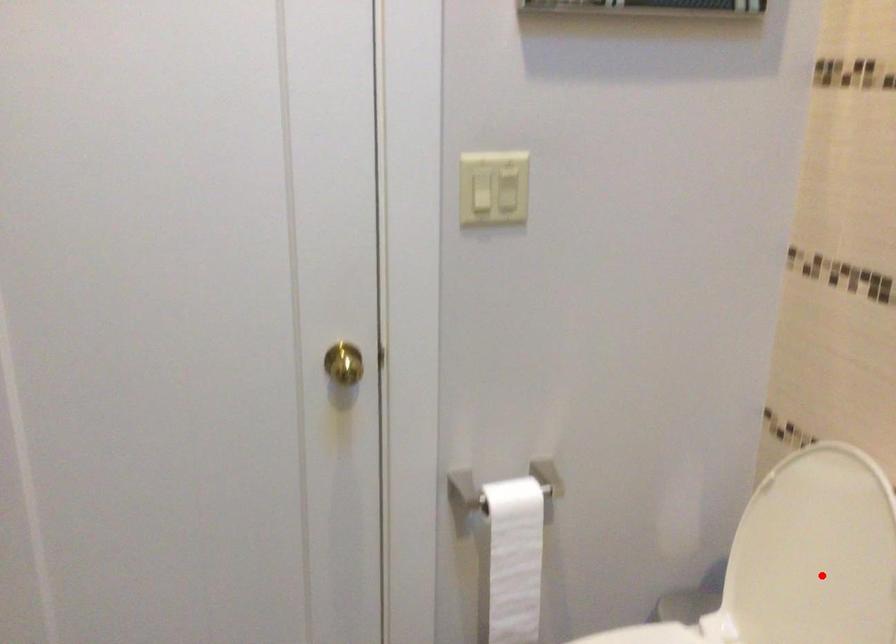
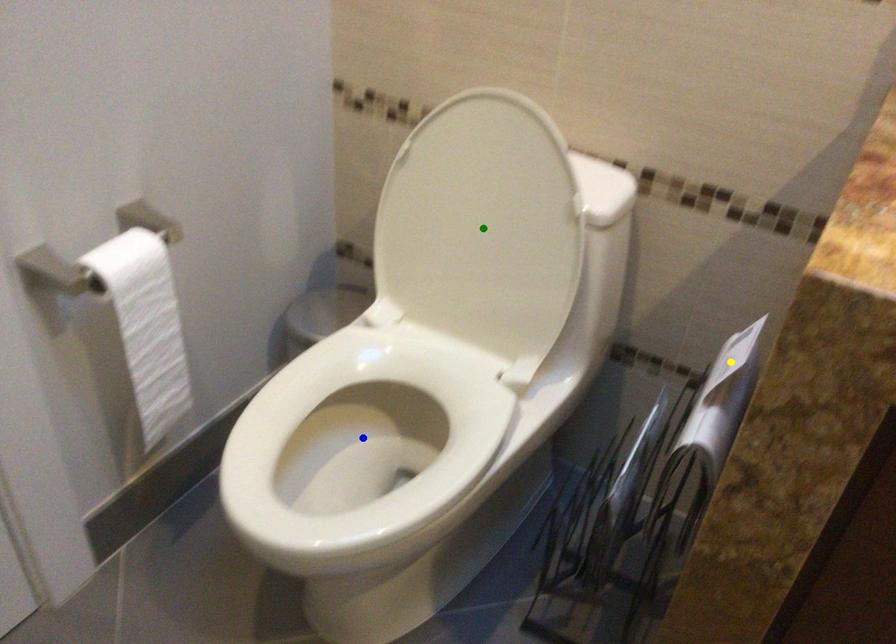
Question: I am providing you with two images of the same scene from different viewpoints. A red point is marked on the first image. You are given multiple points on the second image. Which spot in image 2 lines up with the point in image 1?

Choices:
 (A) yellow point
 (B) blue point
 (C) green point

Answer: (C)